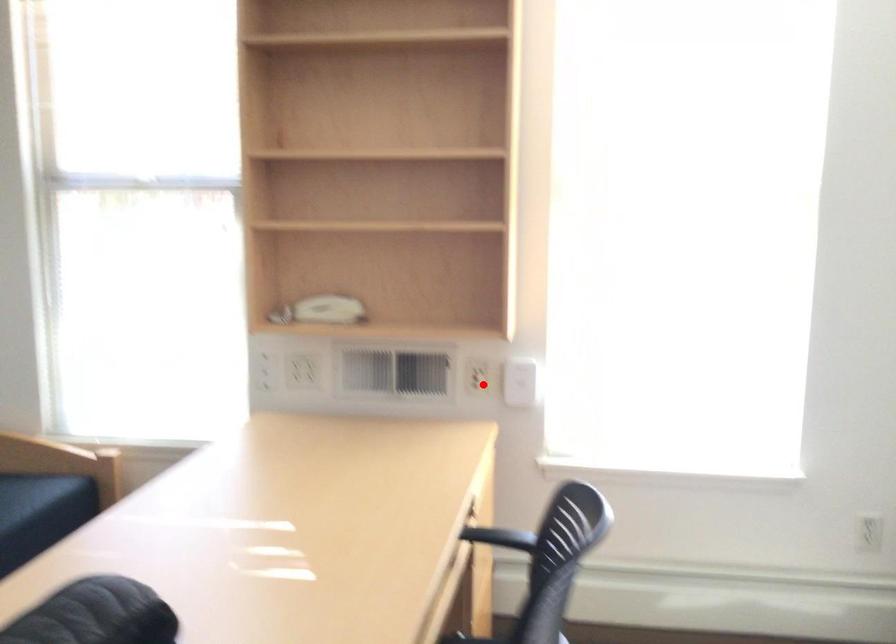
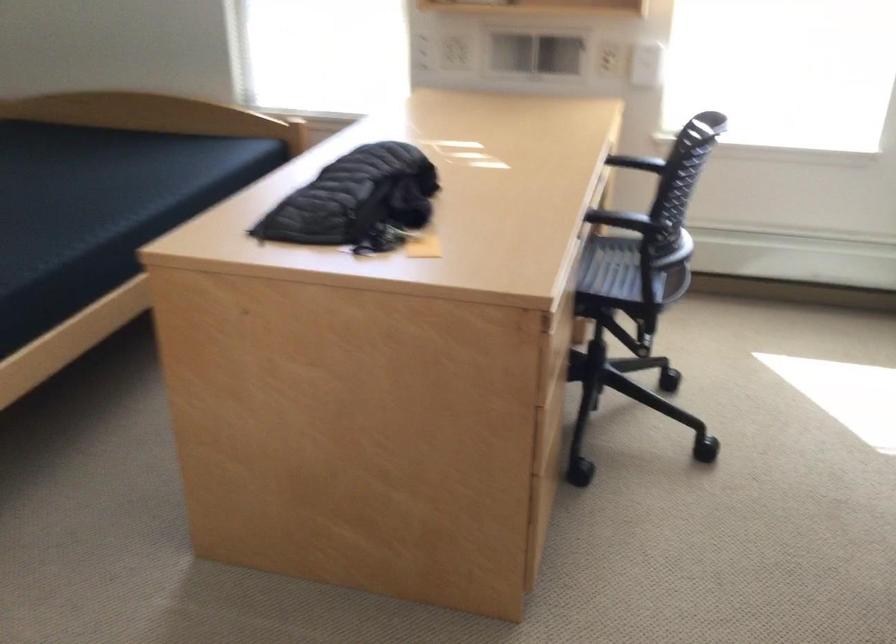
Question: I am providing you with two images of the same scene from different viewpoints. In image1, a red point is highlighted. Considering the same 3D point in image2, which of the following is correct?

Choices:
 (A) It is closer
 (B) It is farther

Answer: (B)